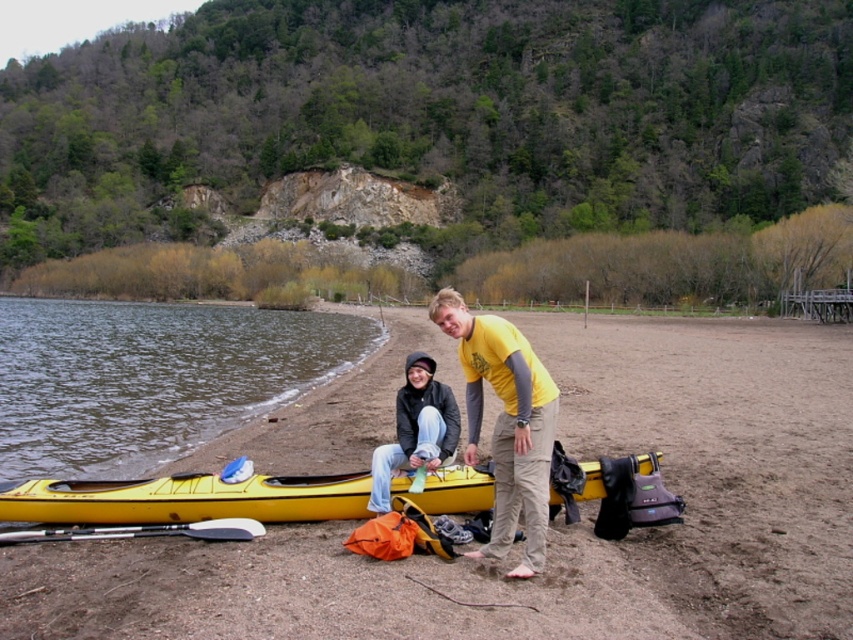
Does brown sandy beach at lower center have a greater height compared to matte yellow kayak at center?

Correct, brown sandy beach at lower center is much taller as matte yellow kayak at center.

Who is higher up, brown sandy beach at lower center or matte yellow kayak at center?

brown sandy beach at lower center

Between point (621, 321) and point (537, 538), which one is positioned behind?

The point (621, 321) is behind.

Image resolution: width=853 pixels, height=640 pixels. Identify the location of brown sandy beach at lower center. (556, 520).

Between point (13, 618) and point (408, 483), which one is positioned in front?

Point (13, 618)

Is point (570, 557) positioned in front of point (407, 496)?

Yes.

Is point (679, 468) more distant than point (83, 508)?

Yes, it is behind point (83, 508).

In order to click on brown sandy beach at lower center in this screenshot , I will do `click(556, 520)`.

Is brown sandy beach at lower center above jeans at center?

Correct, brown sandy beach at lower center is located above jeans at center.

Which is more to the right, brown sandy beach at lower center or jeans at center?

From the viewer's perspective, brown sandy beach at lower center appears more on the right side.

Does point (325, 602) lie in front of point (419, 420)?

Yes, point (325, 602) is in front of point (419, 420).

Locate an element on the screen. This screenshot has height=640, width=853. brown sandy beach at lower center is located at coordinates (556, 520).